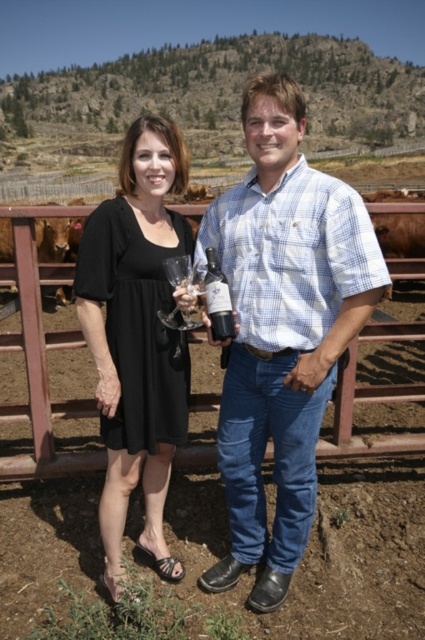
You are a photographer taking a picture of two people wearing the blue checkered shirt at center and the black matte dress at center. Which person should stand to your left to ensure they are on the correct side of the other?

The blue checkered shirt at center is positioned on the right side of black matte dress at center, so the person in the blue checkered shirt at center should stand to your left to be on the right side of the black matte dress at center from the photographer perspective.

You are a photographer trying to capture a photo of the blue checkered shirt at center. The camera you are using has a focal length of 50mm and an aperture of f2.8. The subject is located at point coordinates (x=282, y=328). Can you confirm if the blue checkered shirt at center is within the camera frame?

The blue checkered shirt at center is represented by point (x=282, y=328), so yes, the blue checkered shirt at center is within the camera frame as the point coordinates fall within the standard 1.0x1.0 frame dimensions.

You are taking a photo of the two people in the scene. The first person is at point (292, 456) and the second person is at point (129, 284). Which person is closer to the camera?

Point (292, 456) is closer to the camera than point (129, 284).